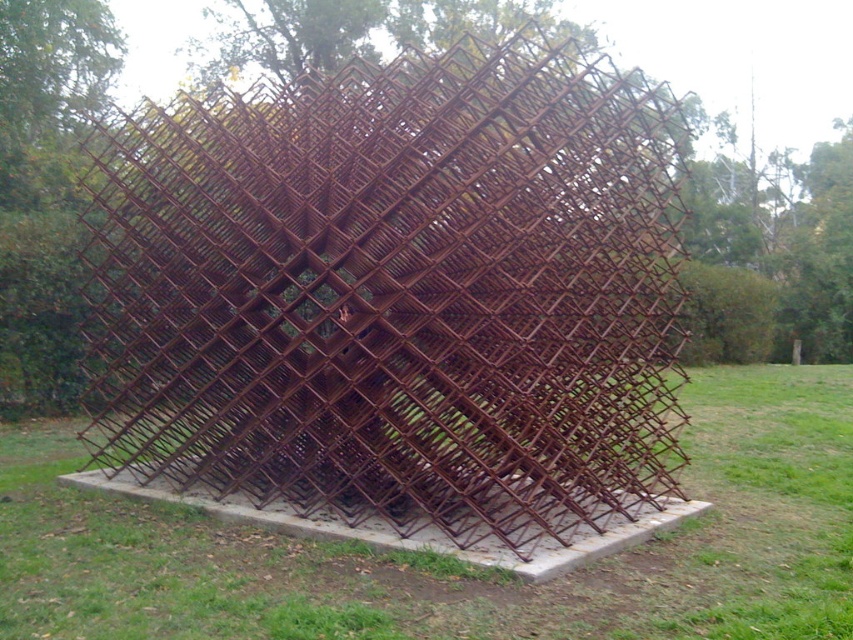
Question: Does rusty metal cage at center appear under rusty metal structure at center?

Choices:
 (A) yes
 (B) no

Answer: (B)

Question: Which of the following is the farthest from the observer?

Choices:
 (A) (392, 104)
 (B) (662, 579)

Answer: (A)

Question: From the image, what is the correct spatial relationship of rusty metal cage at center in relation to rusty metal structure at center?

Choices:
 (A) left
 (B) right

Answer: (A)

Question: Is rusty metal cage at center bigger than rusty metal structure at center?

Choices:
 (A) yes
 (B) no

Answer: (A)